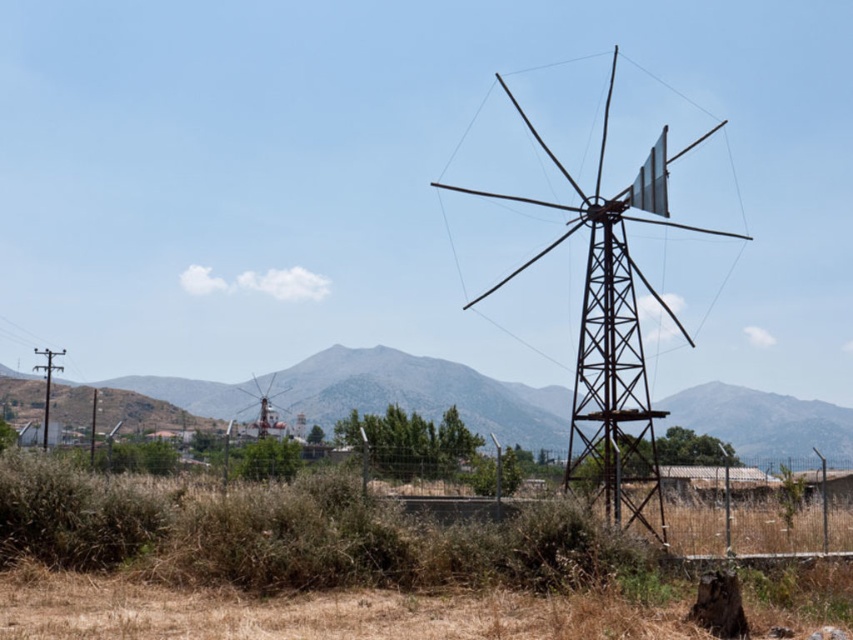
Can you confirm if rustic stone mountain at center is shorter than rusty metal windmill at center?

Indeed, rustic stone mountain at center has a lesser height compared to rusty metal windmill at center.

Looking at this image, does rustic stone mountain at center have a greater height compared to rusty metal windmill at center?

Incorrect, rustic stone mountain at center's height is not larger of rusty metal windmill at center's.

I want to click on rustic stone mountain at center, so click(422, 394).

This screenshot has width=853, height=640. What do you see at coordinates (305, 563) in the screenshot? I see `dry grass at center` at bounding box center [305, 563].

Is dry grass at center below rustic stone mountain at center?

Indeed, dry grass at center is positioned under rustic stone mountain at center.

Image resolution: width=853 pixels, height=640 pixels. Describe the element at coordinates (305, 563) in the screenshot. I see `dry grass at center` at that location.

Where is `dry grass at center`? dry grass at center is located at coordinates (305, 563).

Is point (204, 634) in front of point (712, 232)?

Yes, it is.

At what (x,y) coordinates should I click in order to perform the action: click on dry grass at center. Please return your answer as a coordinate pair (x, y). Looking at the image, I should click on tap(305, 563).